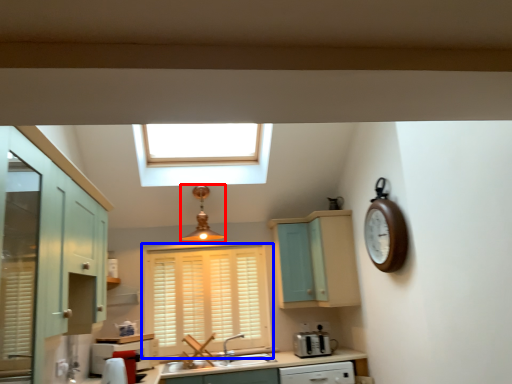
Question: Which object is closer to the camera taking this photo, light fixture (highlighted by a red box) or window (highlighted by a blue box)?

Choices:
 (A) light fixture
 (B) window

Answer: (A)